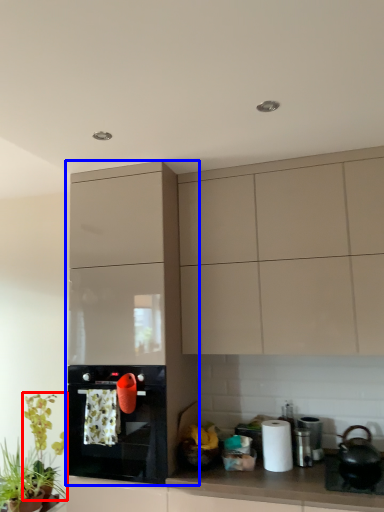
Question: Which of the following is the closest to the observer, plant (highlighted by a red box) or cabinetry (highlighted by a blue box)?

Choices:
 (A) plant
 (B) cabinetry

Answer: (B)